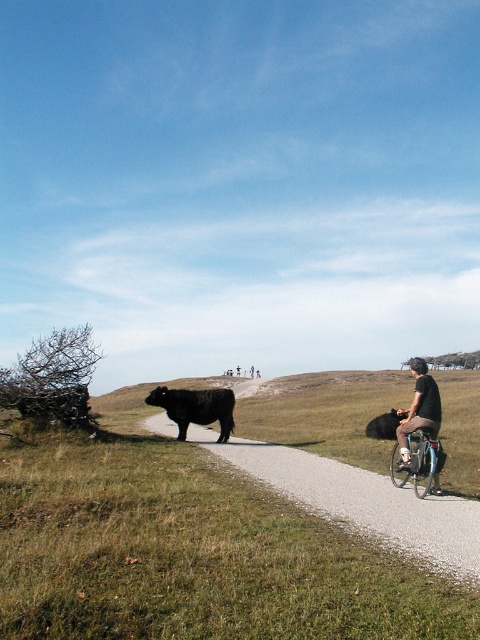
Does black matte bull at center appear on the right side of black fur cow at center?

No, black matte bull at center is not to the right of black fur cow at center.

In the scene shown: Does black matte bull at center lie in front of black fur cow at center?

No.

Does point (162, 397) lie in front of point (372, 419)?

Yes, it is.

Locate an element on the screen. black matte bull at center is located at coordinates (195, 406).

Which of these two, black asphalt path at center or silver metallic bicycle at center-right, stands shorter?

silver metallic bicycle at center-right is shorter.

This screenshot has height=640, width=480. What are the coordinates of `black asphalt path at center` in the screenshot? It's located at (361, 500).

Can you confirm if green grass at center is bigger than silver metallic bicycle at center-right?

Correct, green grass at center is larger in size than silver metallic bicycle at center-right.

Does green grass at center have a smaller size compared to silver metallic bicycle at center-right?

No, green grass at center is not smaller than silver metallic bicycle at center-right.

Is point (235, 484) positioned after point (427, 452)?

Yes, point (235, 484) is farther from viewer.

At what (x,y) coordinates should I click in order to perform the action: click on green grass at center. Please return your answer as a coordinate pair (x, y). Looking at the image, I should click on (189, 547).